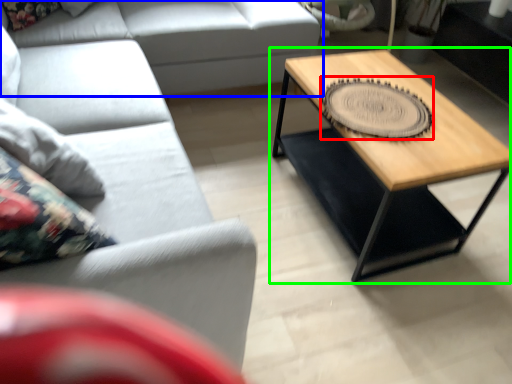
Question: Considering the real-world distances, which object is closest to coaster (highlighted by a red box)? studio couch (highlighted by a blue box) or coffee table (highlighted by a green box).

Choices:
 (A) studio couch
 (B) coffee table

Answer: (B)